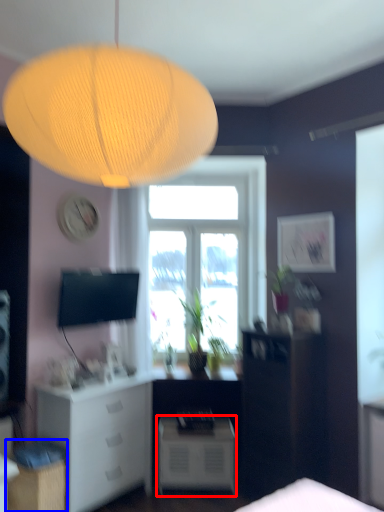
Question: Which object is closer to the camera taking this photo, nightstand (highlighted by a red box) or cabinetry (highlighted by a blue box)?

Choices:
 (A) nightstand
 (B) cabinetry

Answer: (B)